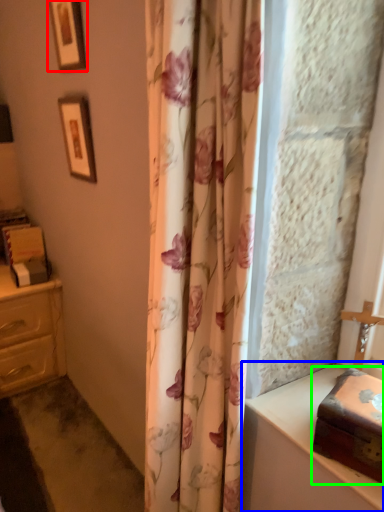
Question: Which object is the closest to the picture frame (highlighted by a red box)? Choose among these: vanity (highlighted by a blue box) or box (highlighted by a green box).

Choices:
 (A) vanity
 (B) box

Answer: (A)